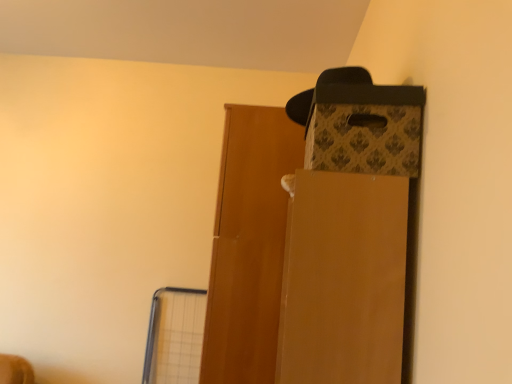
Question: From the image's perspective, does wooden door at center appear lower than matte brown cardboard box at upper right?

Choices:
 (A) yes
 (B) no

Answer: (A)

Question: Does wooden door at center have a larger size compared to matte brown cardboard box at upper right?

Choices:
 (A) yes
 (B) no

Answer: (A)

Question: Does wooden door at center have a lesser width compared to matte brown cardboard box at upper right?

Choices:
 (A) no
 (B) yes

Answer: (A)

Question: Is wooden door at center closer to the viewer compared to matte brown cardboard box at upper right?

Choices:
 (A) no
 (B) yes

Answer: (A)

Question: Considering the relative positions of wooden door at center and matte brown cardboard box at upper right in the image provided, is wooden door at center to the right of matte brown cardboard box at upper right from the viewer's perspective?

Choices:
 (A) no
 (B) yes

Answer: (A)

Question: Is patterned cardboard box at upper right situated inside wooden door at center or outside?

Choices:
 (A) inside
 (B) outside

Answer: (B)

Question: Considering their positions, is patterned cardboard box at upper right located in front of or behind wooden door at center?

Choices:
 (A) front
 (B) behind

Answer: (A)

Question: In terms of height, does patterned cardboard box at upper right look taller or shorter compared to wooden door at center?

Choices:
 (A) short
 (B) tall

Answer: (A)

Question: Is patterned cardboard box at upper right wider or thinner than wooden door at center?

Choices:
 (A) wide
 (B) thin

Answer: (B)

Question: In terms of width, does wooden door at center look wider or thinner when compared to patterned cardboard box at upper right?

Choices:
 (A) thin
 (B) wide

Answer: (B)

Question: From their relative heights in the image, would you say wooden door at center is taller or shorter than patterned cardboard box at upper right?

Choices:
 (A) tall
 (B) short

Answer: (A)

Question: Considering the positions of point (236, 145) and point (381, 160), is point (236, 145) closer or farther from the camera than point (381, 160)?

Choices:
 (A) closer
 (B) farther

Answer: (B)

Question: From a real-world perspective, is wooden door at center above or below patterned cardboard box at upper right?

Choices:
 (A) above
 (B) below

Answer: (B)

Question: Is point (252, 203) positioned closer to the camera than point (372, 284)?

Choices:
 (A) closer
 (B) farther

Answer: (B)

Question: In terms of height, does wooden door at center look taller or shorter compared to matte brown cardboard box at upper right?

Choices:
 (A) short
 (B) tall

Answer: (B)